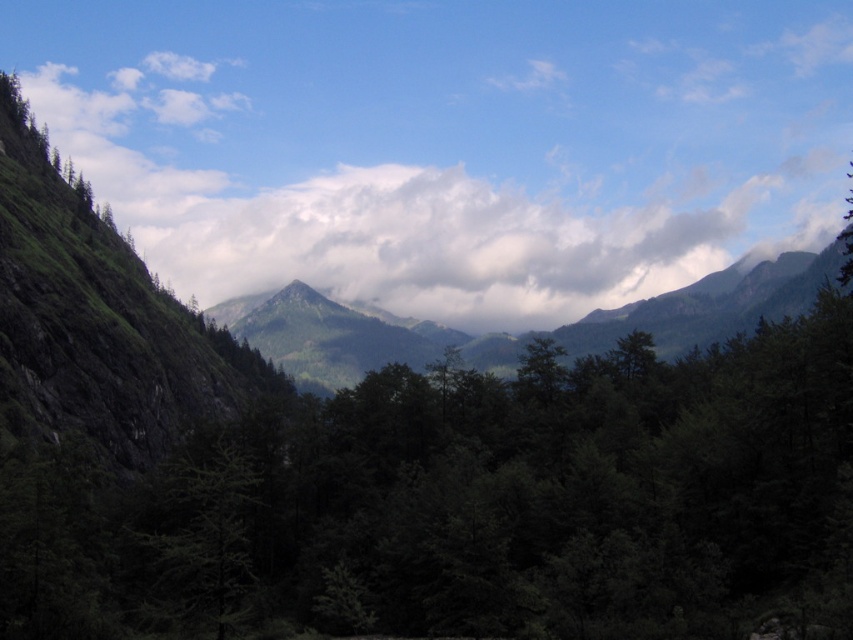
Question: Among these points, which one is farthest from the camera?

Choices:
 (A) (723, 300)
 (B) (416, 260)

Answer: (B)

Question: Which point is farther to the camera?

Choices:
 (A) green matte mountain at center
 (B) green matte tree at center

Answer: (A)

Question: Can you confirm if green matte tree at center is positioned to the left of cloudy sky at upper center?

Choices:
 (A) yes
 (B) no

Answer: (B)

Question: Observing the image, what is the correct spatial positioning of cloudy sky at upper center in reference to green matte mountain at center?

Choices:
 (A) below
 (B) above

Answer: (B)

Question: Which point is closer to the camera taking this photo?

Choices:
 (A) (165, 113)
 (B) (309, 362)
 (C) (236, 525)

Answer: (C)

Question: Considering the relative positions of green matte tree at center and green matte mountain at center in the image provided, where is green matte tree at center located with respect to green matte mountain at center?

Choices:
 (A) left
 (B) right

Answer: (A)